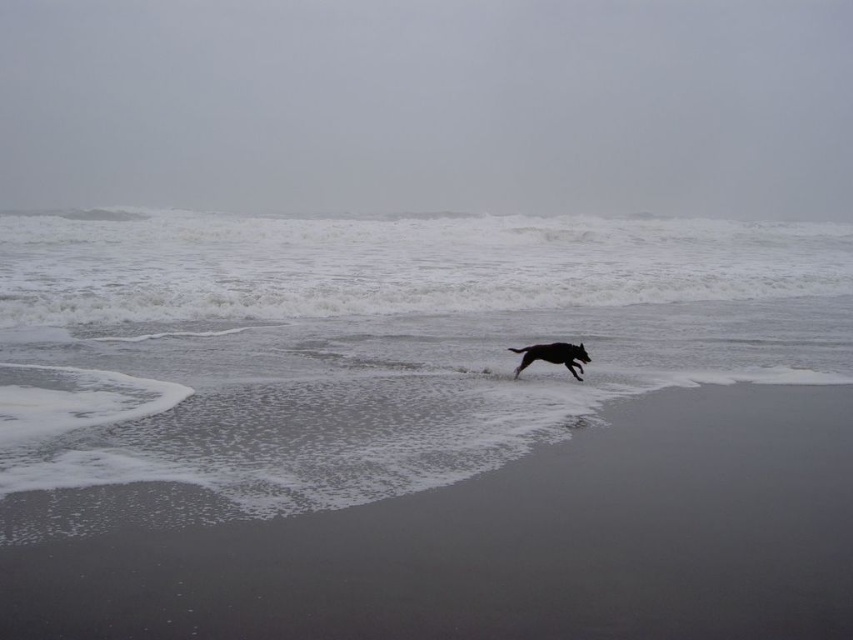
You are standing at the shoreline and notice the white frothy water at center. Based on its position, can you determine if it is closer to the ocean or the beach?

The white frothy water at center is located at point coordinates that place it closer to the ocean, as its position is nearer to the shoreline where waves typically break.

You are a photographer trying to capture the black glossy dog at center while ensuring the gray sand at lower center is visible in the frame. Based on their positions, can you confirm if the dog is standing on the sand?

The gray sand at lower center is positioned under the black glossy dog at center, so yes, the dog is standing on the sand.

You are standing at the beach and want to take a photo of the point at coordinates point (221, 323). If your camera has a maximum focus range of 50 feet, will it be able to focus on the point?

The point at coordinates point (221, 323) is 47.90 feet away from the camera, which is within the maximum focus range of 50 feet. Therefore, the camera can focus on the point.